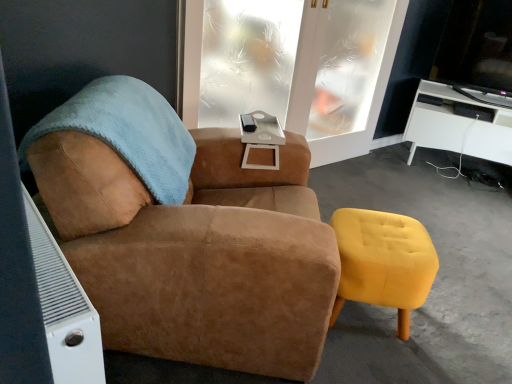
Question: Considering the positions of point (438, 125) and point (205, 72), is point (438, 125) closer or farther from the camera than point (205, 72)?

Choices:
 (A) closer
 (B) farther

Answer: (B)

Question: Is white glossy desk at right bigger or smaller than frosted glass window at center?

Choices:
 (A) small
 (B) big

Answer: (B)

Question: Based on their relative distances, which object is farther from the yellow velvet stool at lower right?

Choices:
 (A) clear frosted glass door at upper center
 (B) frosted glass window at center
 (C) suede brown armchair at center
 (D) white matte side table at center
 (E) white glossy desk at right

Answer: (E)

Question: Considering the real-world distances, which object is farthest from the yellow velvet stool at lower right?

Choices:
 (A) white matte side table at center
 (B) suede brown armchair at center
 (C) white glossy desk at right
 (D) clear frosted glass door at upper center
 (E) frosted glass window at center

Answer: (C)